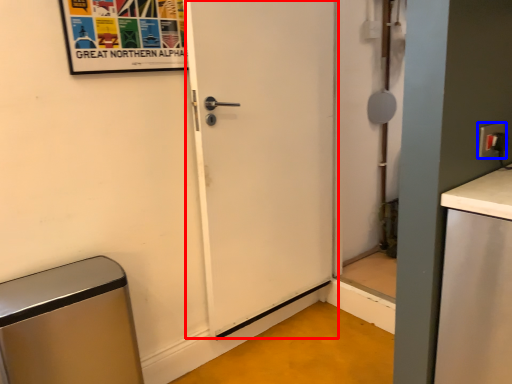
Question: Among these objects, which one is nearest to the camera, door (highlighted by a red box) or electric outlet (highlighted by a blue box)?

Choices:
 (A) door
 (B) electric outlet

Answer: (B)